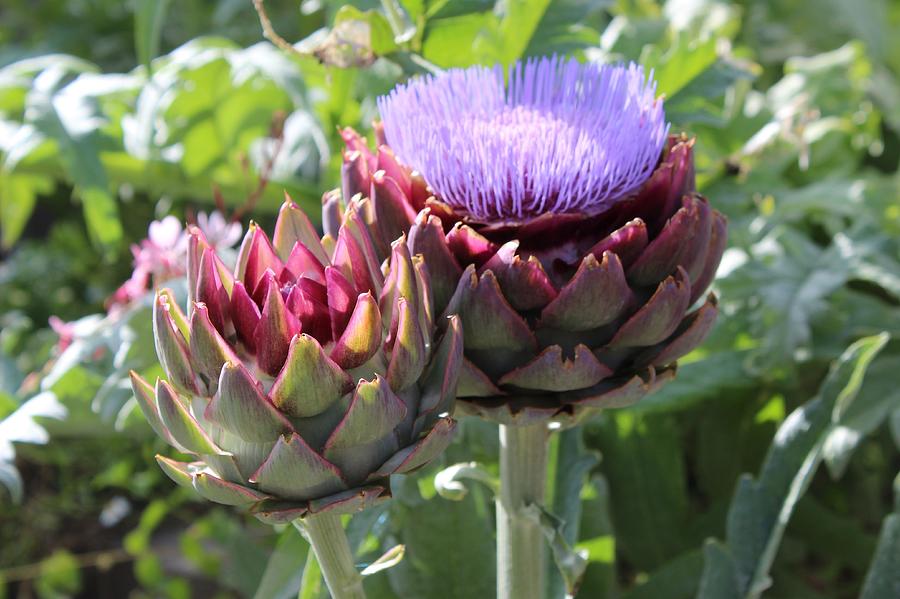
Where is `dark purple pedeastal`? The image size is (900, 599). dark purple pedeastal is located at coordinates (645, 214).